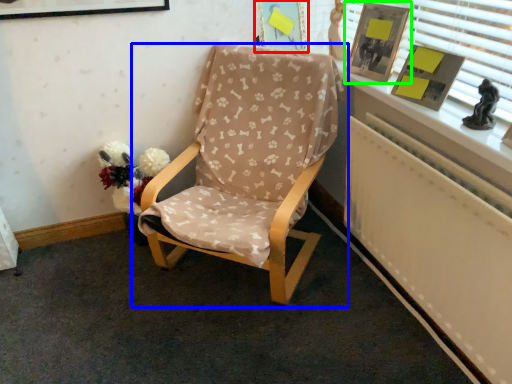
Question: Which object is the closest to the picture frame (highlighted by a red box)? Choose among these: chair (highlighted by a blue box) or picture frame (highlighted by a green box).

Choices:
 (A) chair
 (B) picture frame

Answer: (B)